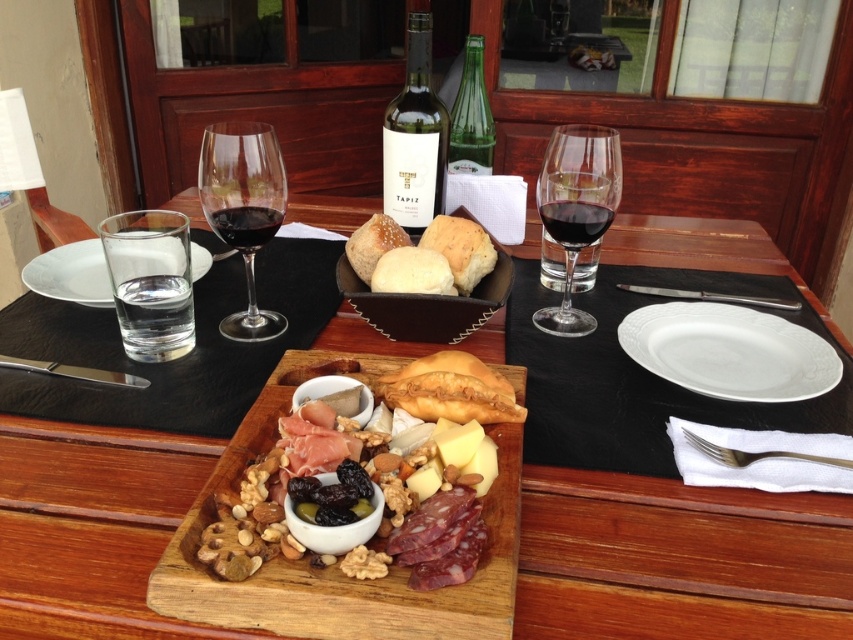
You are a photographer aiming to capture a closeup shot of the wooden cutting board at center. Your camera is currently positioned at a distance that allows it to focus on objects 12 inches away. Can you take the photo without moving the camera closer?

The wooden cutting board at center is 14.64 inches away from the camera. Since the camera focuses best at 12 inches, moving closer would be necessary to achieve a clear closeup.

You are a guest at a dinner party and see the wooden tray at center and the dark red liquid at center. Which object is located below the other?

The wooden tray at center is positioned under the dark red liquid at center, so the wooden tray is below the dark red liquid.

You are setting up a table for a dinner party and need to place a decorative centerpiece. The wooden cutting board at center is currently in the way. Can you move it to the left side of the table without moving the translucent glass wine at upper right? Explain why or why not based on their sizes.

The wooden cutting board at center is wider than the translucent glass wine at upper right. Since the cutting board is wider, moving it to the left side might require more space, but as long as there is enough space on the left, it can be moved without disturbing the glass. The key factor is the available space on the left, not the width comparison alone.